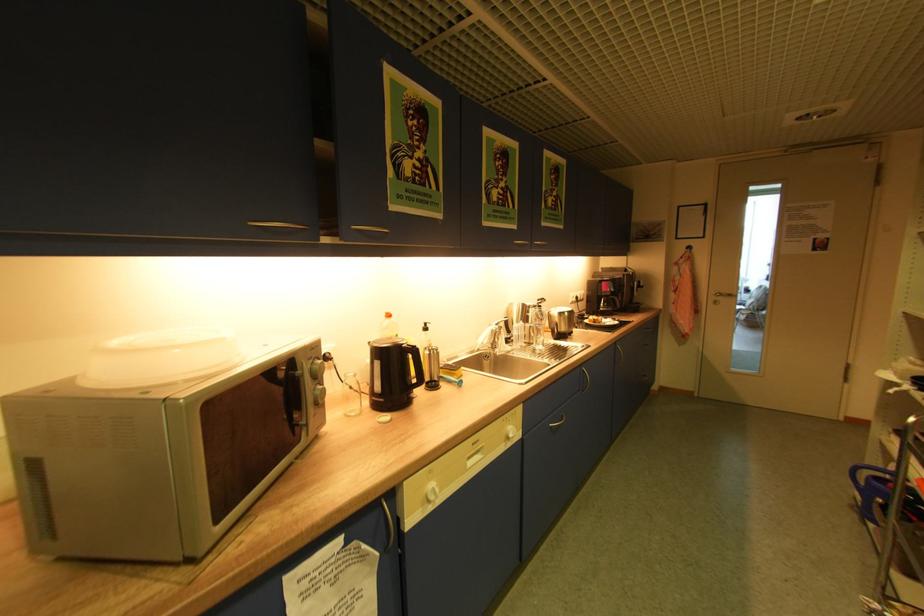
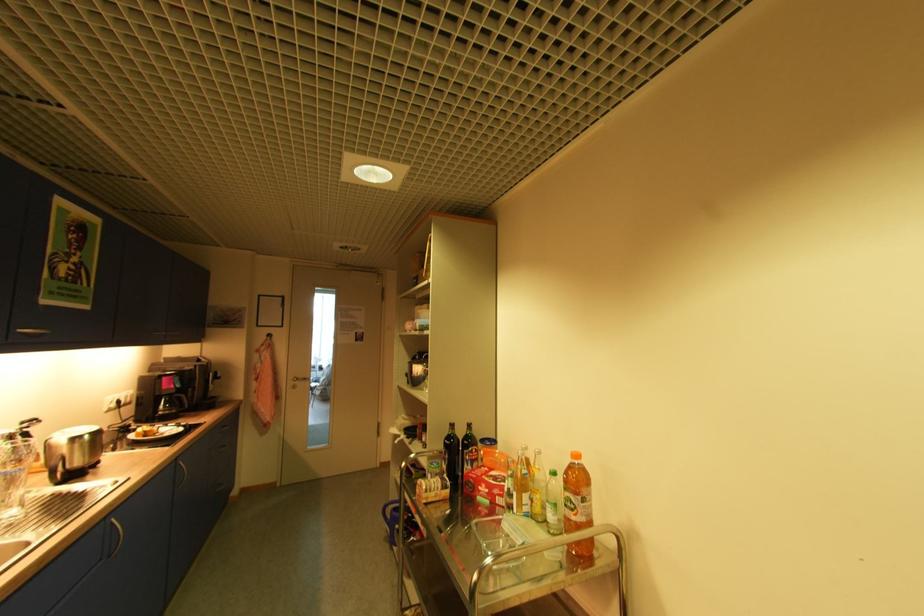
The point at (x=619, y=342) is marked in the first image. Where is the corresponding point in the second image?

(179, 459)